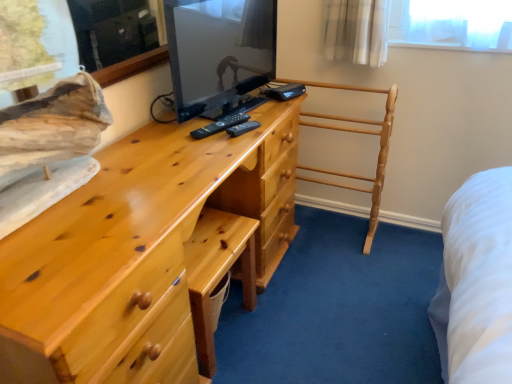
Measure the distance between black plastic remote at center and camera.

black plastic remote at center is 1.32 meters from camera.

Where is `light brown wooden towel rack at center`? light brown wooden towel rack at center is located at coordinates (359, 133).

Is black plastic remote at center to the right of light brown wooden towel rack at center from the viewer's perspective?

In fact, black plastic remote at center is to the left of light brown wooden towel rack at center.

How many degrees apart are the facing directions of black plastic remote at center and light brown wooden towel rack at center?

The facing directions of black plastic remote at center and light brown wooden towel rack at center are 65.5 degrees apart.

Is light brown wooden towel rack at center at the back of black plastic remote at center?

No, black plastic remote at center is not facing away from light brown wooden towel rack at center.

Considering the relative sizes of black plastic remote at center and light brown wooden towel rack at center in the image provided, is black plastic remote at center wider than light brown wooden towel rack at center?

Incorrect, the width of black plastic remote at center does not surpass that of light brown wooden towel rack at center.

Can you confirm if light brown wooden towel rack at center is positioned to the right of matte pine chest of drawers at center?

Yes.

Looking at the image, does light brown wooden towel rack at center seem bigger or smaller compared to matte pine chest of drawers at center?

light brown wooden towel rack at center is smaller than matte pine chest of drawers at center.

Does light brown wooden towel rack at center turn towards matte pine chest of drawers at center?

Yes, light brown wooden towel rack at center is facing matte pine chest of drawers at center.

From a real-world perspective, relative to matte pine chest of drawers at center, is light brown wooden towel rack at center vertically above or below?

Clearly, from a real-world perspective, light brown wooden towel rack at center is above matte pine chest of drawers at center.

Are light brown wooden towel rack at center and black plastic remote at center beside each other?

There is a gap between light brown wooden towel rack at center and black plastic remote at center.

Does point (359, 120) lie behind point (223, 122)?

Yes, point (359, 120) is farther from viewer.

From a real-world perspective, which object stands above the other?

In real-world perspective, black plastic remote at center is above.

Considering the relative sizes of light brown wooden towel rack at center and black plastic remote at center in the image provided, is light brown wooden towel rack at center shorter than black plastic remote at center?

In fact, light brown wooden towel rack at center may be taller than black plastic remote at center.

Which is more to the left, black plastic remote at center or matte black tv at center?

From the viewer's perspective, black plastic remote at center appears more on the left side.

Which is in front, point (243, 119) or point (190, 75)?

The point (190, 75) is more forward.

Can you confirm if light brown wooden towel rack at center is positioned to the left of matte black tv at center?

Incorrect, light brown wooden towel rack at center is not on the left side of matte black tv at center.

Is light brown wooden towel rack at center not inside matte black tv at center?

Yes.

From the image's perspective, is light brown wooden towel rack at center located above or below matte black tv at center?

From the image's perspective, light brown wooden towel rack at center appears below matte black tv at center.

At what (x,y) coordinates should I click in order to perform the action: click on furniture on the right of matte black tv at center. Please return your answer as a coordinate pair (x, y). The image size is (512, 384). Looking at the image, I should click on (359, 133).

Is matte pine chest of drawers at center wider than matte black tv at center?

Yes.

In the scene shown: Is matte pine chest of drawers at center shorter than matte black tv at center?

No, matte pine chest of drawers at center is not shorter than matte black tv at center.

Considering the relative sizes of matte pine chest of drawers at center and matte black tv at center in the image provided, is matte pine chest of drawers at center smaller than matte black tv at center?

No, matte pine chest of drawers at center is not smaller than matte black tv at center.

Considering their positions, is matte pine chest of drawers at center located in front of or behind matte black tv at center?

In the image, matte pine chest of drawers at center appears in front of matte black tv at center.

Which object is positioned more to the right, matte black tv at center or black plastic remote at center?

matte black tv at center.

Is matte black tv at center directly adjacent to black plastic remote at center?

They are not placed beside each other.

Is black plastic remote at center a part of matte black tv at center?

No, black plastic remote at center is not surrounded by matte black tv at center.

Image resolution: width=512 pixels, height=384 pixels. Identify the location of furniture located underneath the black plastic remote at center (from a real-world perspective). (359, 133).

Where is `furniture on the right of matte pine chest of drawers at center`? This screenshot has height=384, width=512. furniture on the right of matte pine chest of drawers at center is located at coordinates (359, 133).

Looking at the image, which one is located further to matte black tv at center, black plastic remote at center or matte pine chest of drawers at center?

Based on the image, matte pine chest of drawers at center appears to be further to matte black tv at center.

From the picture: Which object lies nearer to the anchor point black plastic remote at center, matte pine chest of drawers at center or matte black tv at center?

matte black tv at center.

Based on their spatial positions, is black plastic remote at center or matte black tv at center further from matte pine chest of drawers at center?

Based on the image, black plastic remote at center appears to be further to matte pine chest of drawers at center.

Estimate the real-world distances between objects in this image. Which object is further from matte black tv at center, light brown wooden towel rack at center or matte pine chest of drawers at center?

light brown wooden towel rack at center.

Looking at the image, which one is located closer to light brown wooden towel rack at center, matte pine chest of drawers at center or matte black tv at center?

matte black tv at center lies closer to light brown wooden towel rack at center than the other object.

Estimate the real-world distances between objects in this image. Which object is further from light brown wooden towel rack at center, black plastic remote at center or matte pine chest of drawers at center?

matte pine chest of drawers at center is further to light brown wooden towel rack at center.

From the image, which object appears to be nearer to matte black tv at center, matte pine chest of drawers at center or light brown wooden towel rack at center?

matte pine chest of drawers at center.

When comparing their distances from matte pine chest of drawers at center, does matte black tv at center or light brown wooden towel rack at center seem further?

light brown wooden towel rack at center is further to matte pine chest of drawers at center.

Image resolution: width=512 pixels, height=384 pixels. I want to click on television between black plastic remote at center and light brown wooden towel rack at center in the horizontal direction, so click(x=220, y=54).

At what (x,y) coordinates should I click in order to perform the action: click on remote positioned between matte pine chest of drawers at center and light brown wooden towel rack at center from near to far. Please return your answer as a coordinate pair (x, y). Looking at the image, I should click on click(220, 125).

Find the location of `television positioned between matte pine chest of drawers at center and black plastic remote at center from near to far`. television positioned between matte pine chest of drawers at center and black plastic remote at center from near to far is located at coordinates (220, 54).

The image size is (512, 384). Identify the location of television located between matte pine chest of drawers at center and light brown wooden towel rack at center in the depth direction. (220, 54).